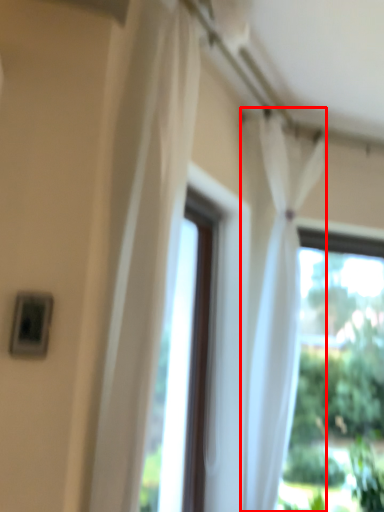
Question: Considering the relative positions of curtain (annotated by the red box) and curtain in the image provided, where is curtain (annotated by the red box) located with respect to the staircase?

Choices:
 (A) right
 (B) left

Answer: (A)